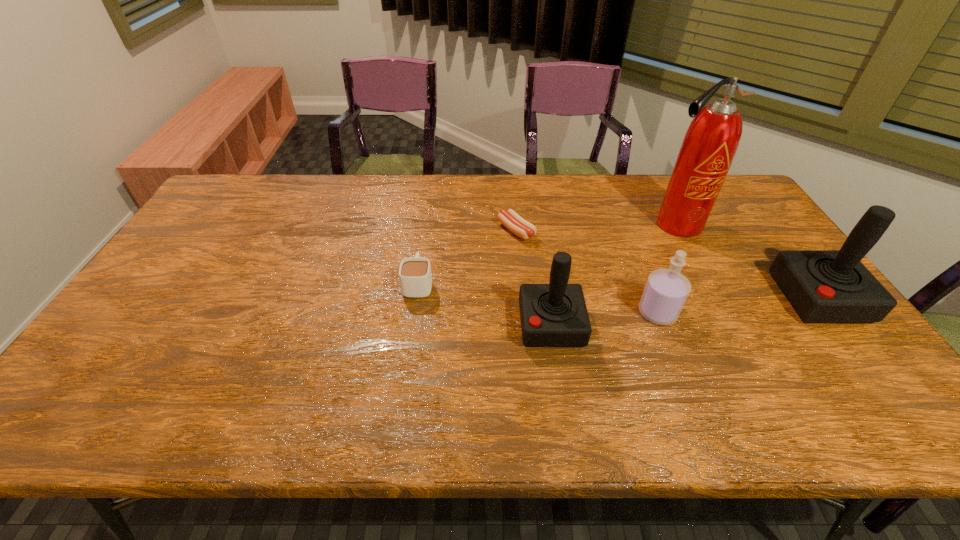
This screenshot has height=540, width=960. I want to click on vacant space located on the base of the shorter joystick, so click(x=462, y=325).

The image size is (960, 540). Identify the location of vacant region located 0.100m on the base of the shorter joystick. (481, 325).

At what (x,y) coordinates should I click in order to perform the action: click on free point located 0.170m on the base of the taller joystick. Please return your answer as a coordinate pair (x, y). This screenshot has width=960, height=540. Looking at the image, I should click on (719, 298).

This screenshot has width=960, height=540. Identify the location of vacant space located on the base of the taller joystick. 697,298.

The image size is (960, 540). I want to click on blank space located on the base of the taller joystick, so click(x=649, y=298).

What are the coordinates of `vacant space situated on the front of the fire extinguisher` in the screenshot? It's located at (720, 309).

This screenshot has height=540, width=960. What are the coordinates of `free space located on the right of the shortest object` in the screenshot? It's located at (576, 231).

Identify the location of vacant position located on the side with the handle of the cup. (425, 230).

You are a GUI agent. You are given a task and a screenshot of the screen. Output one action in this format:
    pyautogui.click(x=<x>, y=<y>)
    Task: Click on the vacant space located 0.130m on the side with the handle of the cup
    Image resolution: width=960 pixels, height=540 pixels.
    Given the screenshot: What is the action you would take?
    pyautogui.click(x=424, y=240)

What are the coordinates of `blank space located on the side with the handle of the cup` in the screenshot? It's located at (430, 198).